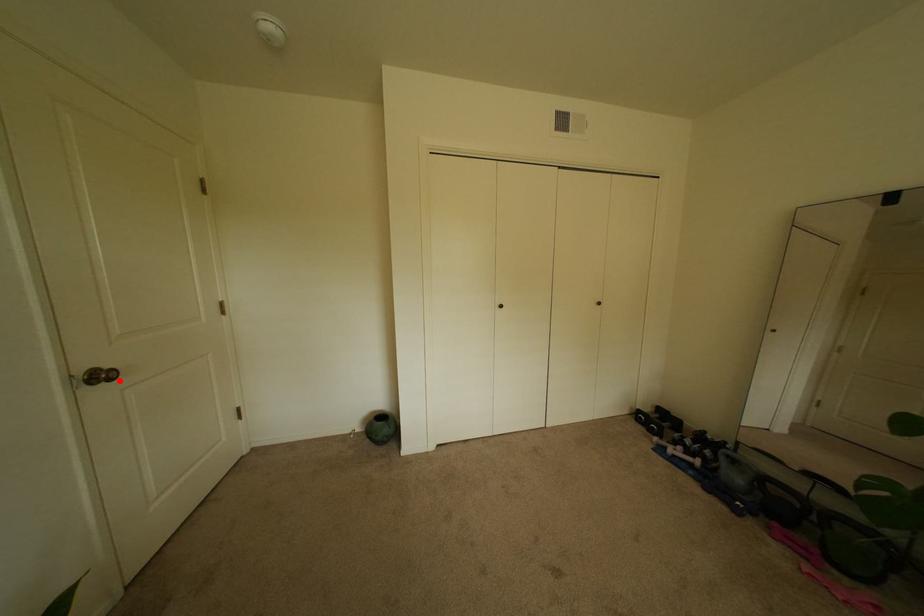
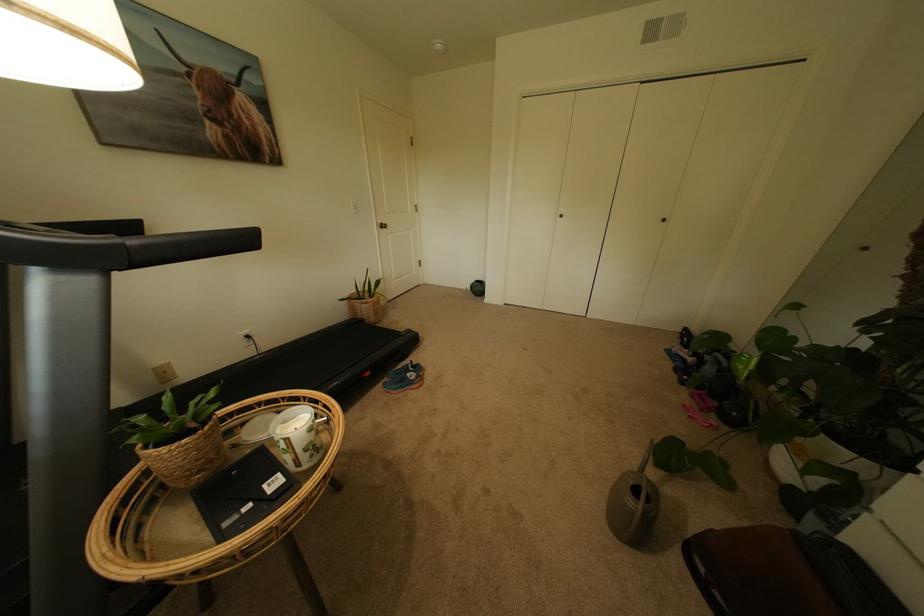
Where in the second image is the point corresponding to the highlighted location from the first image?

(394, 229)